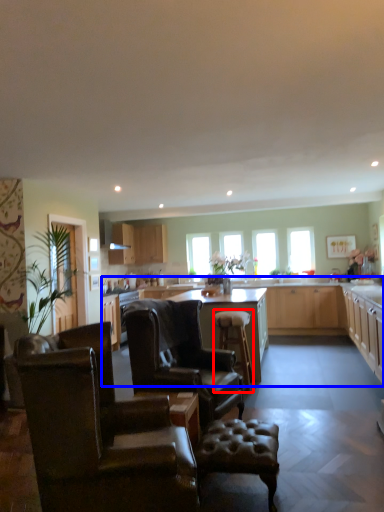
Question: Which of the following is the farthest to the observer, bar stool (highlighted by a red box) or countertop (highlighted by a blue box)?

Choices:
 (A) bar stool
 (B) countertop

Answer: (A)